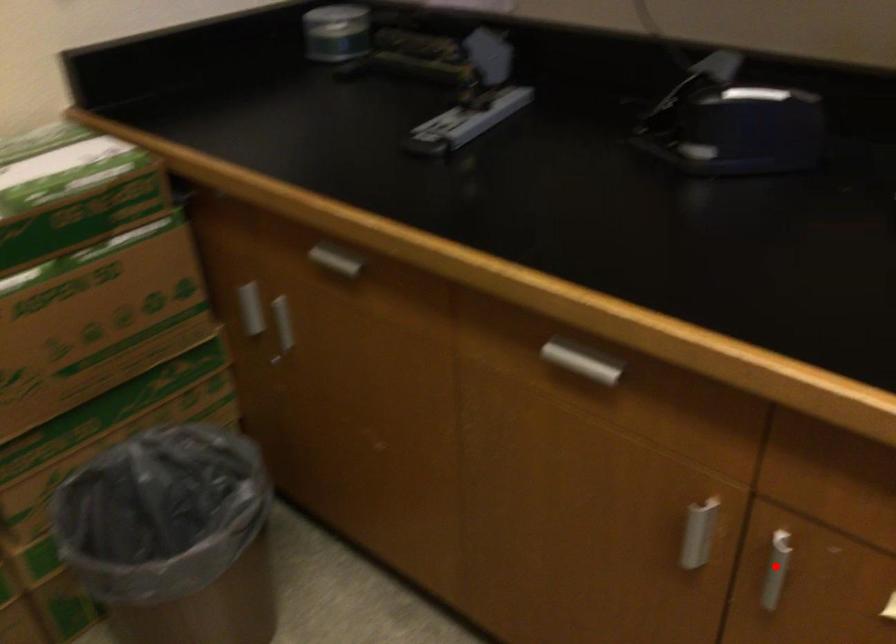
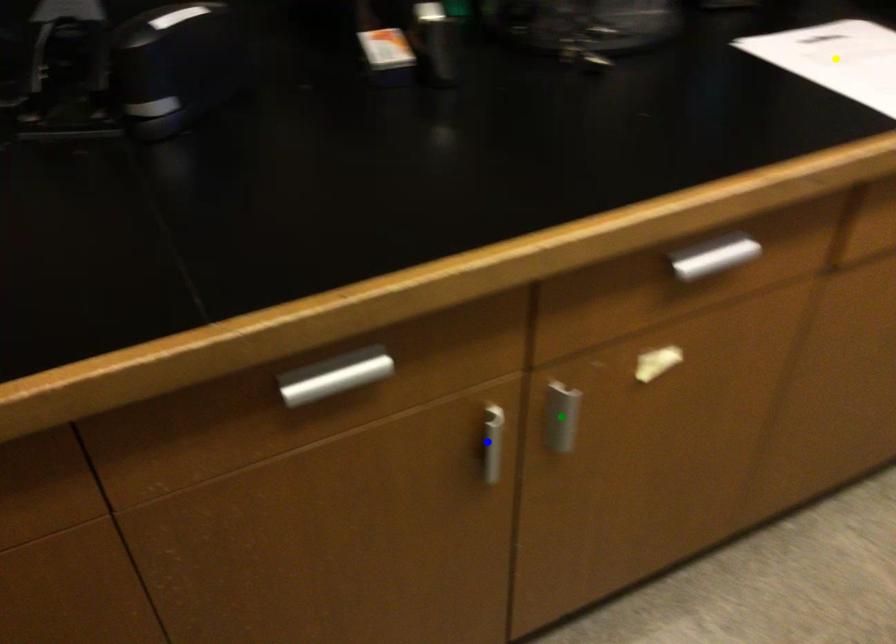
Question: I am providing you with two images of the same scene from different viewpoints. A red point is marked on the first image. You are given multiple points on the second image. In image 2, which mark is for the same physical point as the one in image 1?

Choices:
 (A) yellow point
 (B) green point
 (C) blue point

Answer: (B)